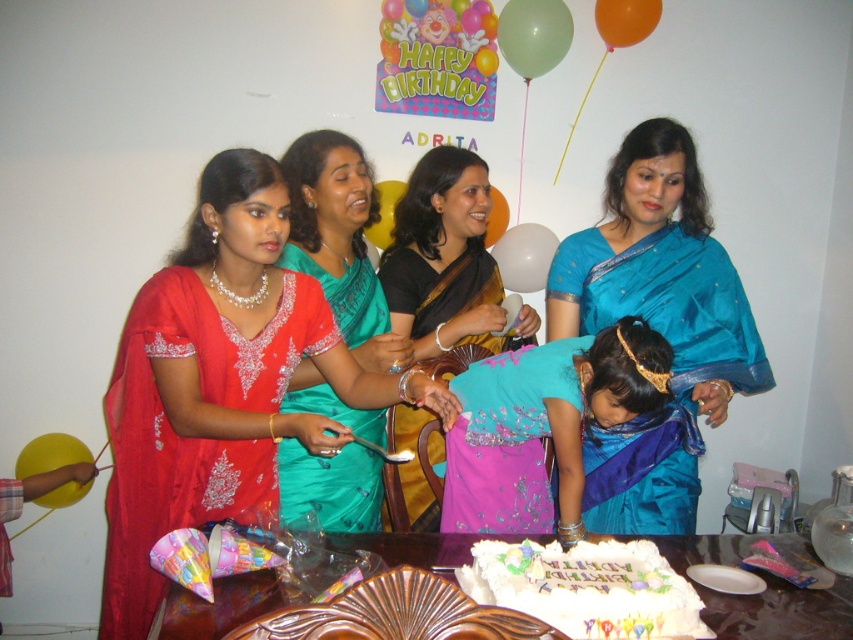
From the picture: Is the position of matte red saree at center less distant than that of green silk saree at center?

Yes, matte red saree at center is in front of green silk saree at center.

I want to click on matte red saree at center, so click(x=221, y=381).

The image size is (853, 640). Identify the location of matte red saree at center. (221, 381).

Can you confirm if blue silk saree at center is positioned to the left of turquoise satin dress at center?

No, blue silk saree at center is not to the left of turquoise satin dress at center.

Does blue silk saree at center have a greater height compared to turquoise satin dress at center?

Yes, blue silk saree at center is taller than turquoise satin dress at center.

The image size is (853, 640). Find the location of `blue silk saree at center`. blue silk saree at center is located at coordinates (657, 324).

This screenshot has height=640, width=853. What are the coordinates of `blue silk saree at center` in the screenshot? It's located at (657, 324).

Can you confirm if blue silk saree at center is positioned to the left of black satin saree at center?

No, blue silk saree at center is not to the left of black satin saree at center.

Locate an element on the screen. Image resolution: width=853 pixels, height=640 pixels. blue silk saree at center is located at coordinates (657, 324).